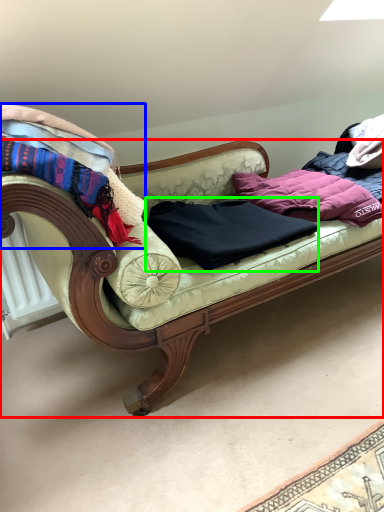
Question: Estimate the real-world distances between objects in this image. Which object is closer to studio couch (highlighted by a red box), blanket (highlighted by a blue box) or clothing (highlighted by a green box)?

Choices:
 (A) blanket
 (B) clothing

Answer: (B)